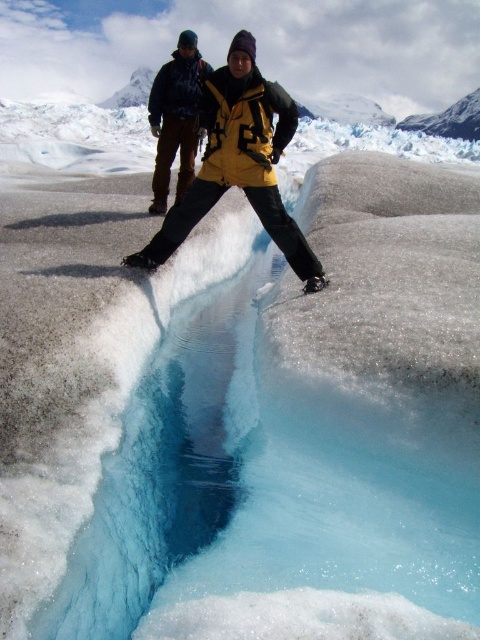
Question: Considering the relative positions of yellow matte jacket at center and matte black jacket at center in the image provided, where is yellow matte jacket at center located with respect to matte black jacket at center?

Choices:
 (A) below
 (B) above

Answer: (A)

Question: Is yellow matte jacket at center to the right of matte black jacket at center from the viewer's perspective?

Choices:
 (A) yes
 (B) no

Answer: (A)

Question: Observing the image, what is the correct spatial positioning of yellow matte jacket at center in reference to matte black jacket at center?

Choices:
 (A) below
 (B) above

Answer: (A)

Question: Which of the following is the farthest from the observer?

Choices:
 (A) matte black jacket at center
 (B) yellow matte jacket at center

Answer: (A)